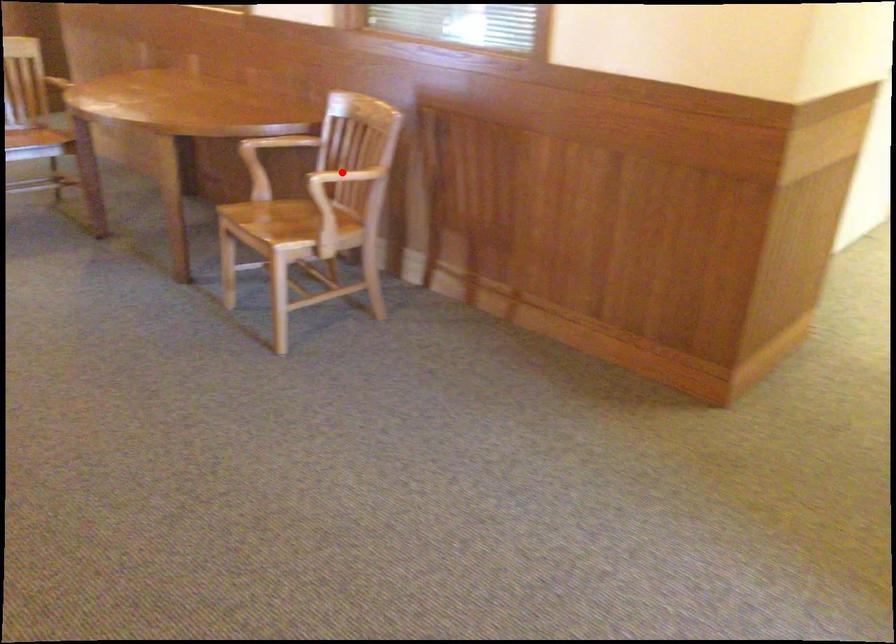
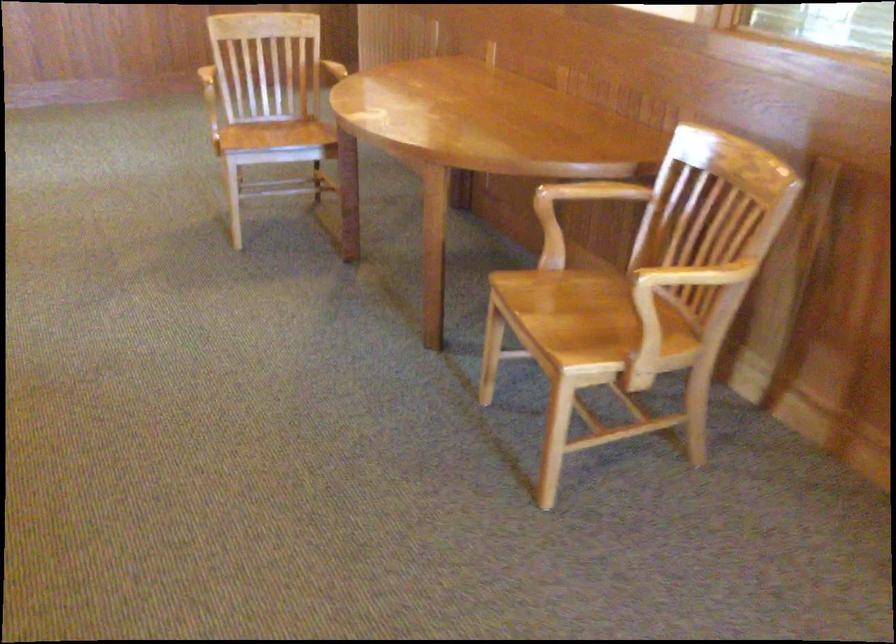
Question: I am providing you with two images of the same scene from different viewpoints. In image1, a red point is highlighted. Considering the same 3D point in image2, which of the following is correct?

Choices:
 (A) It is closer
 (B) It is farther

Answer: (A)